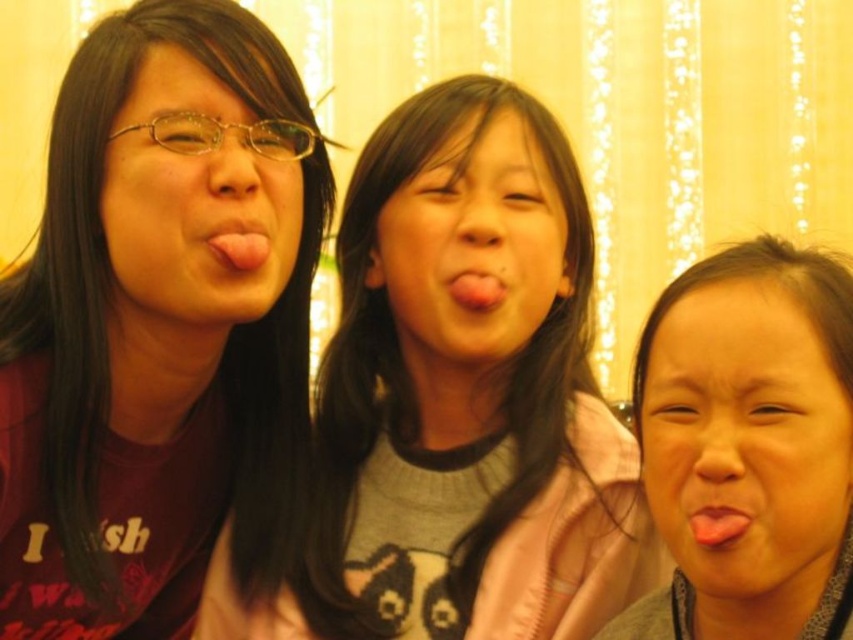
Is point (409, 256) positioned in front of point (260, 246)?

No, (409, 256) is behind (260, 246).

Between point (392, 280) and point (257, 259), which one is positioned in front?

Point (257, 259)

The image size is (853, 640). Identify the location of smooth skin face at center. (473, 246).

Is point (724, 538) closer to viewer compared to point (447, 282)?

Yes, point (724, 538) is in front of point (447, 282).

In the scene shown: Can you confirm if pink glossy tongue at lower right is positioned to the left of pink matte tongue at center?

In fact, pink glossy tongue at lower right is to the right of pink matte tongue at center.

Identify the location of pink glossy tongue at lower right. (717, 524).

Between matte gray face at center and matte black face at left, which one has less height?

With less height is matte gray face at center.

Is point (744, 301) positioned behind point (233, 186)?

That is False.

Locate an element on the screen. matte gray face at center is located at coordinates (746, 442).